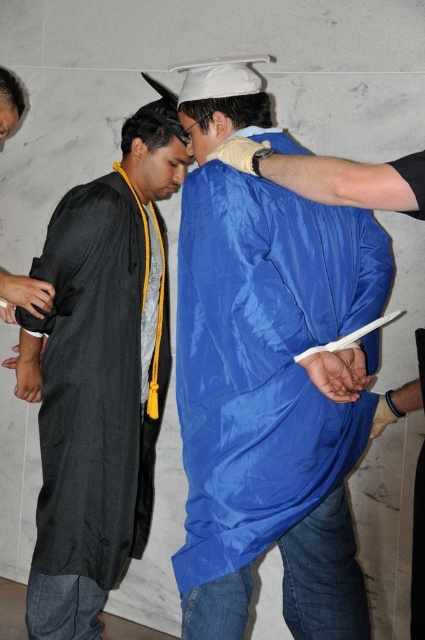
Who is shorter, blue fabric graduation gown at center or matte black graduation gown at left?

blue fabric graduation gown at center

Between point (342, 260) and point (155, 115), which one is positioned behind?

The point (155, 115) is more distant.

This screenshot has height=640, width=425. Find the location of `blue fabric graduation gown at center`. blue fabric graduation gown at center is located at coordinates (269, 376).